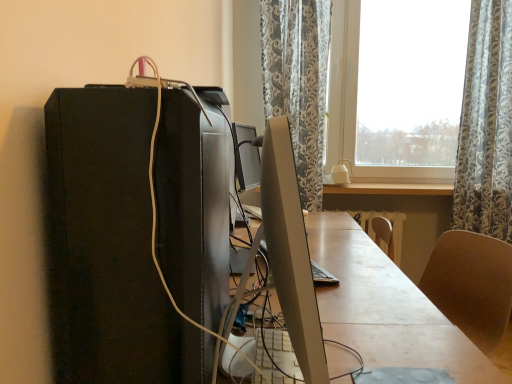
Find the location of `vacant area situated below satin silver monitor at center (from a real-world perspective)`. vacant area situated below satin silver monitor at center (from a real-world perspective) is located at coordinates (273, 356).